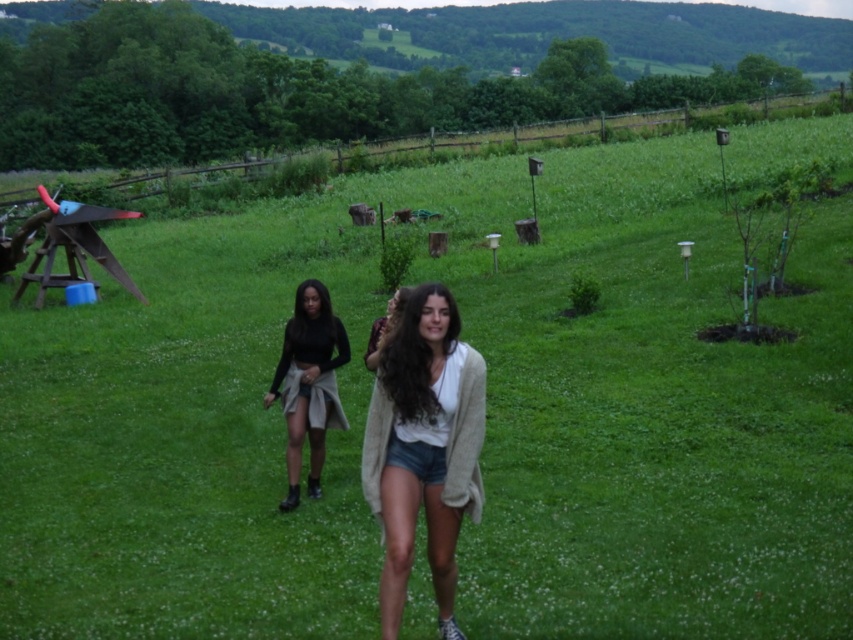
Question: Which point appears closest to the camera in this image?

Choices:
 (A) (288, 401)
 (B) (476, 362)

Answer: (B)

Question: Which of the following is the farthest from the observer?

Choices:
 (A) tap(299, 440)
 (B) tap(473, 349)

Answer: (A)

Question: Does light beige sweater at center have a lesser width compared to matte black top at center?

Choices:
 (A) yes
 (B) no

Answer: (A)

Question: Can you confirm if light beige sweater at center is wider than matte black top at center?

Choices:
 (A) yes
 (B) no

Answer: (B)

Question: Which object is farther from the camera taking this photo?

Choices:
 (A) matte black top at center
 (B) light beige sweater at center

Answer: (A)

Question: Does light beige sweater at center appear on the right side of matte black top at center?

Choices:
 (A) no
 (B) yes

Answer: (B)